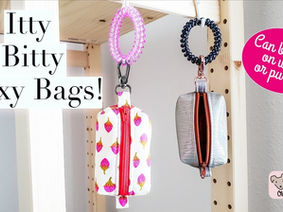
Identify the location of tan wood leg. The image size is (283, 212). (51, 181).